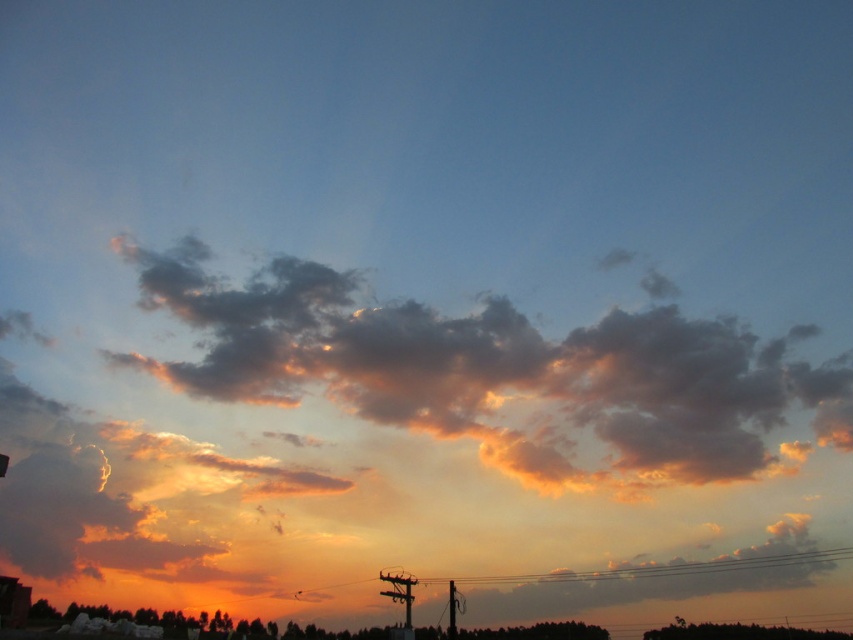
Question: Which point is farther from the camera taking this photo?

Choices:
 (A) (376, 362)
 (B) (337, 582)

Answer: (B)

Question: Considering the relative positions of orange-hued cotton clouds at upper center and metallic wire at center in the image provided, where is orange-hued cotton clouds at upper center located with respect to metallic wire at center?

Choices:
 (A) right
 (B) left

Answer: (B)

Question: Observing the image, what is the correct spatial positioning of orange-hued cotton clouds at upper center in reference to metallic wire at center?

Choices:
 (A) left
 (B) right

Answer: (A)

Question: Which of the following is the closest to the observer?

Choices:
 (A) metallic wire at center
 (B) orange-hued cotton clouds at upper center

Answer: (A)

Question: Can you confirm if orange-hued cotton clouds at upper center is thinner than metallic wire at center?

Choices:
 (A) yes
 (B) no

Answer: (B)